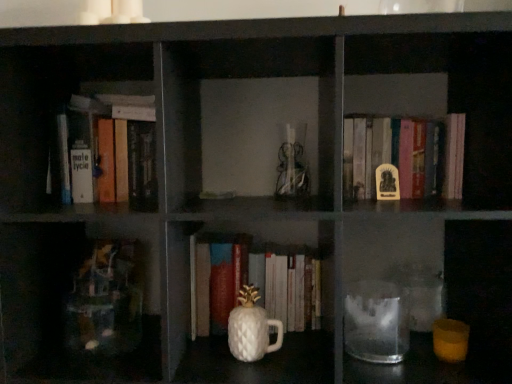
Question: Looking at the image, does hardcover book at upper left, which is the first book in left-to-right order, seem bigger or smaller compared to transparent glass jar at lower center?

Choices:
 (A) big
 (B) small

Answer: (A)

Question: Is hardcover book at upper left, which is the first book in left-to-right order, spatially inside transparent glass jar at lower center, or outside of it?

Choices:
 (A) outside
 (B) inside

Answer: (A)

Question: Which object is the farthest from the yellow matte statue at center, which is the 1th book from right to left?

Choices:
 (A) transparent glass jar at lower center
 (B) white glossy pineapple-shaped cup at center
 (C) hardcover book at upper left, which is the first book in left-to-right order

Answer: (C)

Question: Estimate the real-world distances between objects in this image. Which object is farther from the hardcover book at upper left, which is the first book in left-to-right order?

Choices:
 (A) white glossy pineapple-shaped cup at center
 (B) yellow matte statue at center, the second book viewed from the left
 (C) transparent glass jar at lower center

Answer: (C)